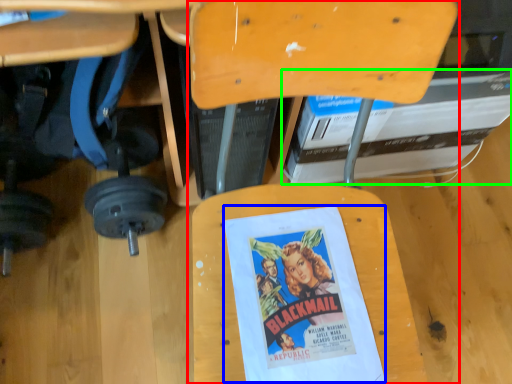
Question: Considering the real-world distances, which object is closest to chair (highlighted by a red box)? movie poster (highlighted by a blue box) or paperback book (highlighted by a green box).

Choices:
 (A) movie poster
 (B) paperback book

Answer: (A)